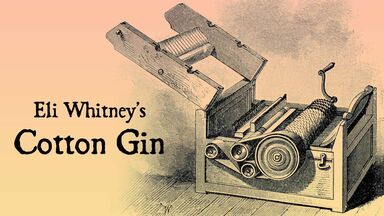
I want to click on corners, so (x=374, y=8), (x=11, y=7), (x=13, y=202), (x=377, y=211).